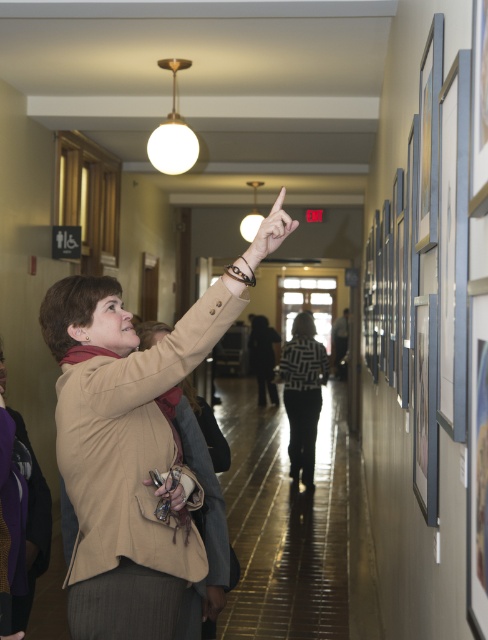
You are an artist visiting an art gallery. You notice two items in the scene described in the image. The first is the beige fabric coat at upper left, and the second is the matte brown purse at upper center. Which of these two items is wider?

The beige fabric coat at upper left is wider than the matte brown purse at upper center, as stated in the objects description that the coat surpasses the purse in width.

You are an artist visiting an art gallery and see the matte skin hand at upper center and the matte brown purse at upper center. Which object is wider?

The matte skin hand at upper center is wider than the matte brown purse at upper center.